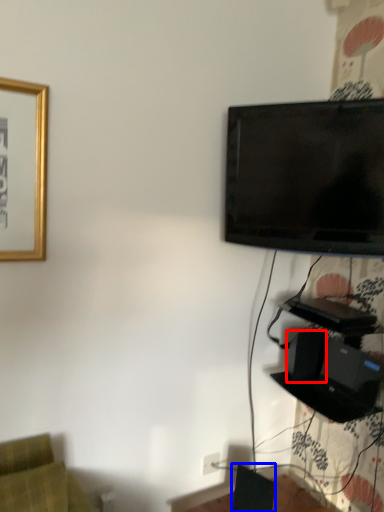
Question: Which of the following is the farthest to the observer, speaker (highlighted by a red box) or speaker (highlighted by a blue box)?

Choices:
 (A) speaker
 (B) speaker

Answer: (A)